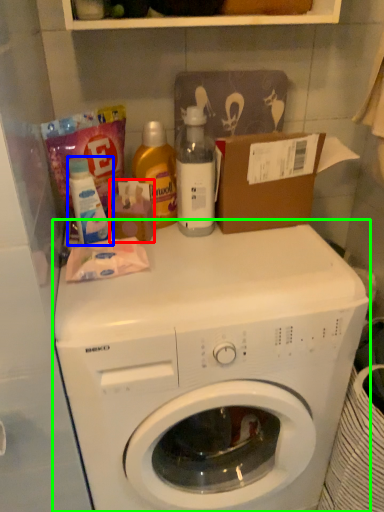
Question: Which object is the closest to the toiletry (highlighted by a red box)? Choose among these: cleaning product (highlighted by a blue box) or washing machine (highlighted by a green box).

Choices:
 (A) cleaning product
 (B) washing machine

Answer: (A)